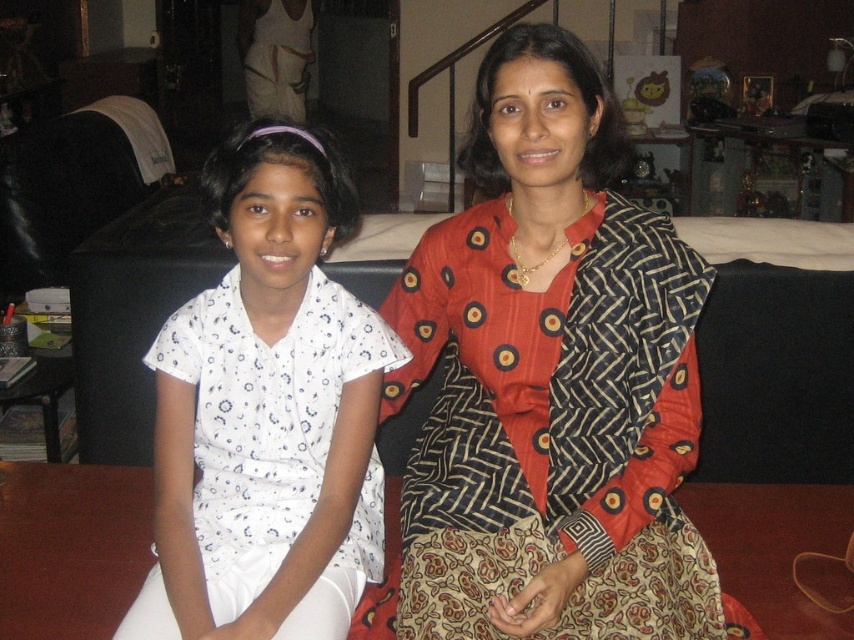
Question: Does red printed sari at center appear under white printed blouse at left?

Choices:
 (A) yes
 (B) no

Answer: (B)

Question: Which point is farther to the camera?

Choices:
 (A) (197, 570)
 (B) (446, 316)

Answer: (B)

Question: Does red printed sari at center lie behind white printed blouse at left?

Choices:
 (A) no
 (B) yes

Answer: (B)

Question: Does red printed sari at center have a lesser width compared to white printed blouse at left?

Choices:
 (A) yes
 (B) no

Answer: (B)

Question: Which of the following is the farthest from the observer?

Choices:
 (A) (436, 596)
 (B) (358, 458)

Answer: (B)